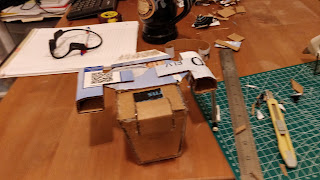
I want to click on cutting board, so click(313, 121).